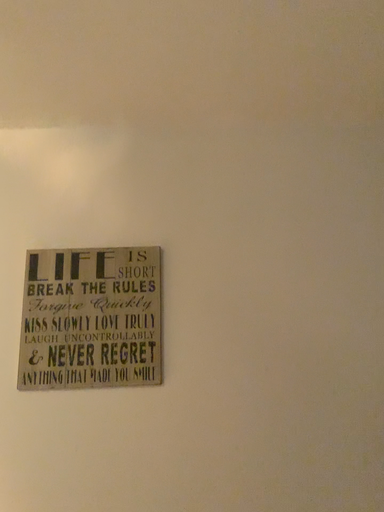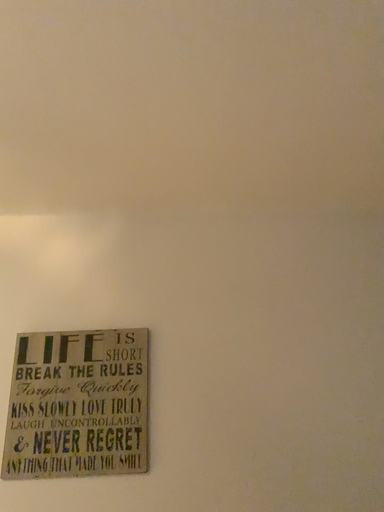
Question: Which way did the camera rotate in the video?

Choices:
 (A) rotated upward
 (B) rotated downward

Answer: (A)